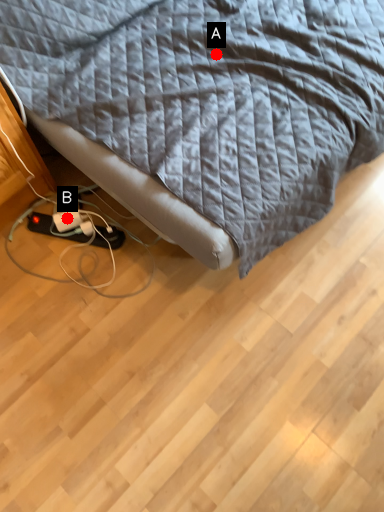
Question: Two points are circled on the image, labeled by A and B beside each circle. Which point appears farthest from the camera in this image?

Choices:
 (A) A is further
 (B) B is further

Answer: (B)